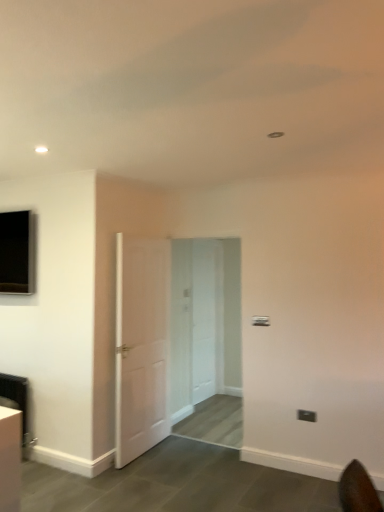
Question: Relative to white wooden door at center, which appears as the first door when viewed from the back, is black glass window at upper left in front or behind?

Choices:
 (A) front
 (B) behind

Answer: (A)

Question: In the image, is black glass window at upper left on the left side or the right side of white wooden door at center, which appears as the first door when viewed from the back?

Choices:
 (A) left
 (B) right

Answer: (A)

Question: Which object is the closest to the black glass window at upper left?

Choices:
 (A) white wooden door at center, which appears as the first door when viewed from the back
 (B) white matte door at center, marked as the 1th door in a front-to-back arrangement
 (C) black plastic electric outlet at lower right

Answer: (B)

Question: Which is nearer to the black glass window at upper left?

Choices:
 (A) white matte door at center, marked as the 1th door in a front-to-back arrangement
 (B) black plastic electric outlet at lower right
 (C) white wooden door at center, marked as the 2th door in a left-to-right arrangement

Answer: (A)